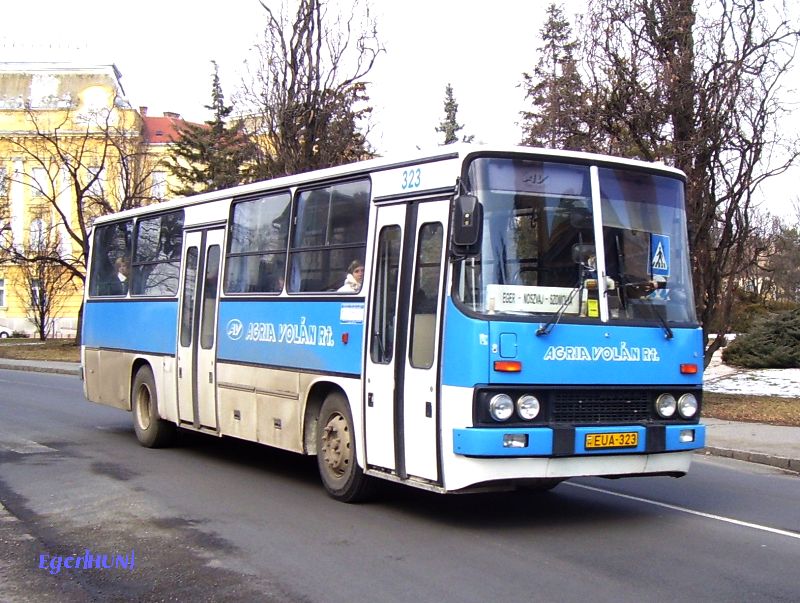
At what (x,y) coordinates should I click in order to perform the action: click on doors. Please return your answer as a coordinate pair (x, y). This screenshot has height=603, width=800. Looking at the image, I should click on (410, 336), (388, 330), (210, 314), (190, 313).